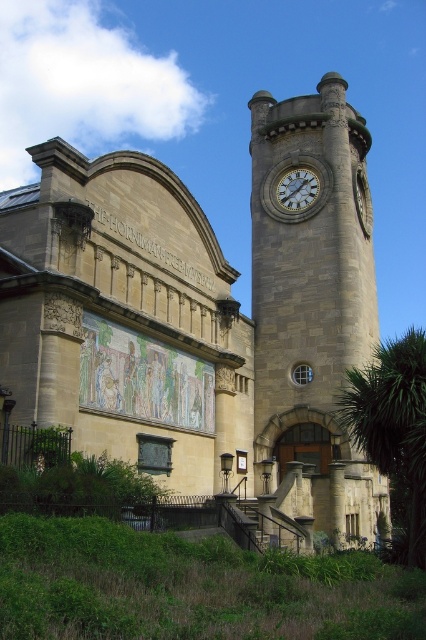
Question: Can you confirm if stone clock tower at center is positioned to the left of white stone clock at upper center?

Choices:
 (A) yes
 (B) no

Answer: (A)

Question: Is stone clock tower at center closer to the viewer compared to white stone clock at upper center?

Choices:
 (A) no
 (B) yes

Answer: (B)

Question: Which object is farther from the camera taking this photo?

Choices:
 (A) stone clock tower at center
 (B) white stone clock at upper center

Answer: (B)

Question: Which point is farther to the camera?

Choices:
 (A) (298, 205)
 (B) (296, 452)

Answer: (A)

Question: Does stone clock tower at center have a larger size compared to white stone clock at upper center?

Choices:
 (A) yes
 (B) no

Answer: (A)